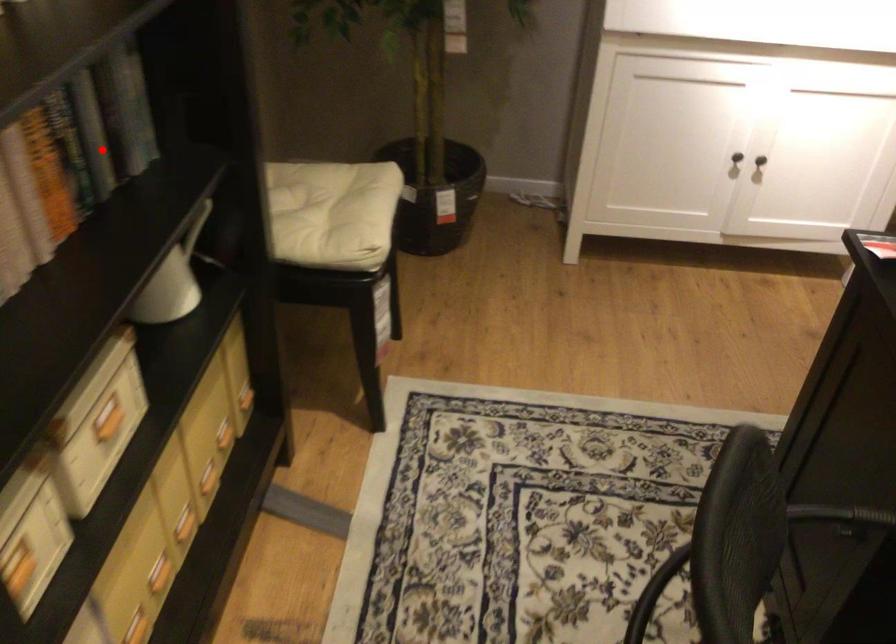
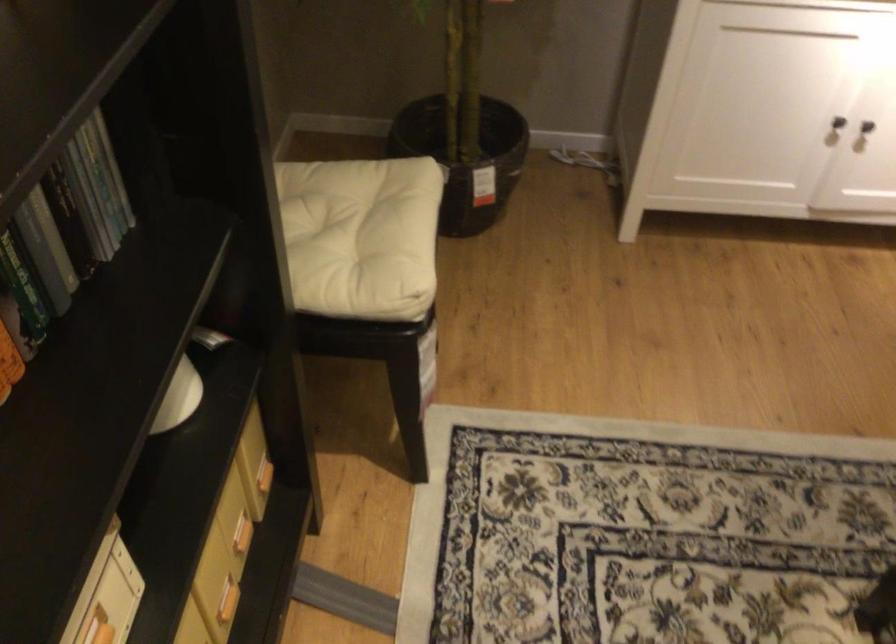
Question: I am providing you with two images of the same scene from different viewpoints. In image1, a red point is highlighted. Considering the same 3D point in image2, which of the following is correct?

Choices:
 (A) It is closer
 (B) It is farther

Answer: (A)